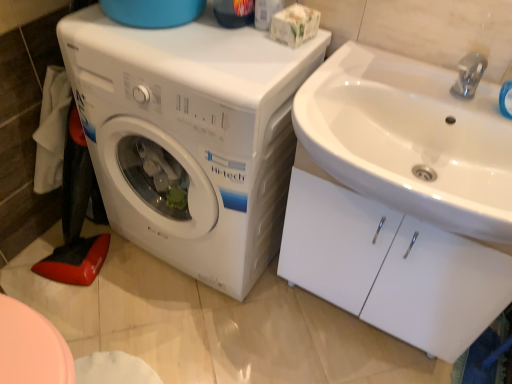
Question: Is white plastic washing machine at left taller than white glossy sink at upper right?

Choices:
 (A) yes
 (B) no

Answer: (A)

Question: From the image's perspective, would you say white plastic washing machine at left is shown under white glossy sink at upper right?

Choices:
 (A) no
 (B) yes

Answer: (A)

Question: Would you say white plastic washing machine at left is outside white glossy sink at upper right?

Choices:
 (A) no
 (B) yes

Answer: (B)

Question: Does white plastic washing machine at left appear on the left side of white glossy sink at upper right?

Choices:
 (A) yes
 (B) no

Answer: (A)

Question: Does white plastic washing machine at left contain white glossy sink at upper right?

Choices:
 (A) no
 (B) yes

Answer: (A)

Question: From a real-world perspective, is white plastic washing machine at left positioned above or below white glossy sink at upper right?

Choices:
 (A) below
 (B) above

Answer: (B)

Question: Which is correct: white plastic washing machine at left is inside white glossy sink at upper right, or outside of it?

Choices:
 (A) inside
 (B) outside

Answer: (B)

Question: Does point (230, 254) appear closer or farther from the camera than point (393, 228)?

Choices:
 (A) closer
 (B) farther

Answer: (B)

Question: Is white plastic washing machine at left to the left or to the right of white glossy sink at upper right in the image?

Choices:
 (A) right
 (B) left

Answer: (B)

Question: Is point (461, 258) closer or farther from the camera than point (392, 172)?

Choices:
 (A) closer
 (B) farther

Answer: (B)

Question: From a real-world perspective, is white glossy sink at upper right above or below white glossy sink at upper right?

Choices:
 (A) above
 (B) below

Answer: (B)

Question: From the image's perspective, is white glossy sink at upper right above or below white glossy sink at upper right?

Choices:
 (A) above
 (B) below

Answer: (B)

Question: Is white glossy sink at upper right in front of or behind white glossy sink at upper right in the image?

Choices:
 (A) behind
 (B) front

Answer: (A)

Question: In terms of height, does white glossy sink at upper right look taller or shorter compared to white plastic washing machine at left?

Choices:
 (A) short
 (B) tall

Answer: (A)

Question: From a real-world perspective, is white glossy sink at upper right positioned above or below white plastic washing machine at left?

Choices:
 (A) below
 (B) above

Answer: (A)